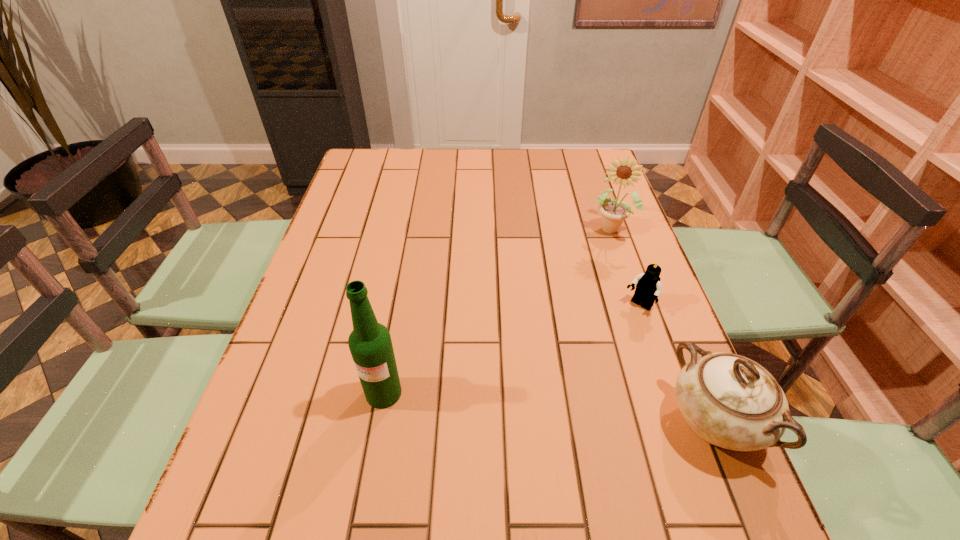
Image resolution: width=960 pixels, height=540 pixels. I want to click on free space on the desktop that is between the leftmost object and the third tallest object and is positioned on the front-facing side of the farthest object, so click(541, 406).

This screenshot has width=960, height=540. What are the coordinates of `free space on the desktop that is between the beer bottle and the chinaware and is positioned on the front-facing side of the third nearest object` in the screenshot? It's located at (546, 407).